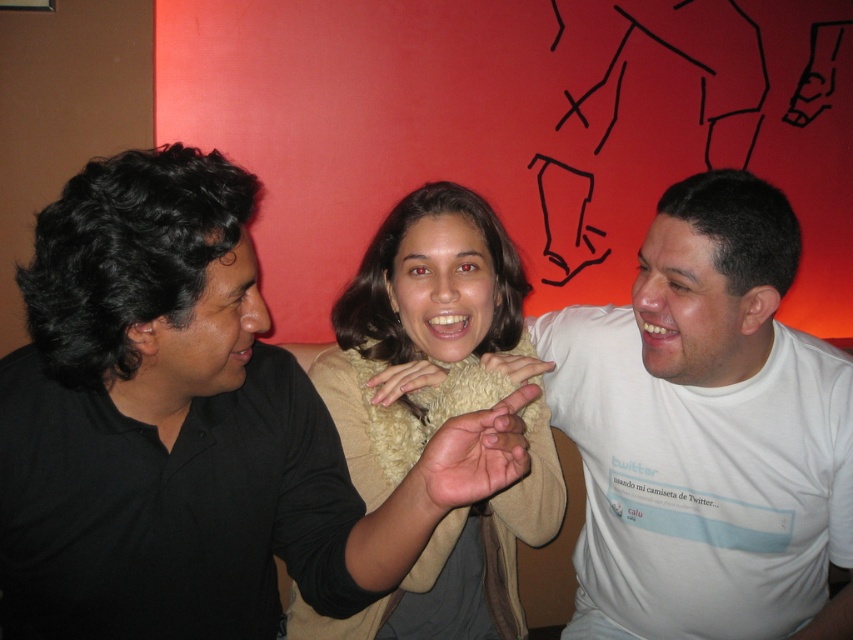
You are a photographer trying to capture a candid shot of the black matte shirt at left and the white cotton shirt at center. Which one is located more to the left side of the image?

The black matte shirt at left is positioned on the left side of the white cotton shirt at center, so the black matte shirt at left is more to the left side of the image.